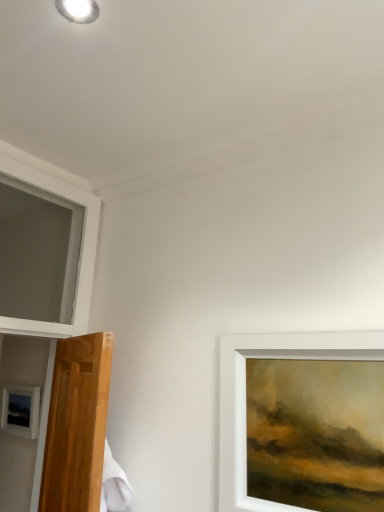
Question: From a real-world perspective, is matte black picture frame at lower left physically located above or below white glossy droplight at upper left?

Choices:
 (A) below
 (B) above

Answer: (A)

Question: Is matte black picture frame at lower left to the left or to the right of white glossy droplight at upper left in the image?

Choices:
 (A) left
 (B) right

Answer: (A)

Question: Considering the real-world distances, which object is closest to the white frame at upper left?

Choices:
 (A) matte black picture frame at lower left
 (B) white glossy droplight at upper left

Answer: (A)

Question: Which is nearer to the matte black picture frame at lower left?

Choices:
 (A) white frame at upper left
 (B) white glossy droplight at upper left

Answer: (A)